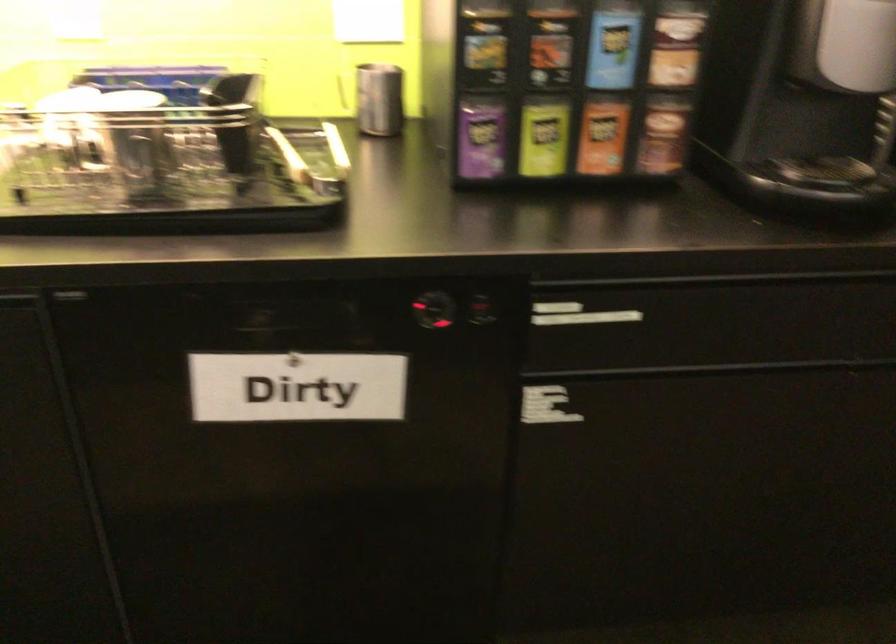
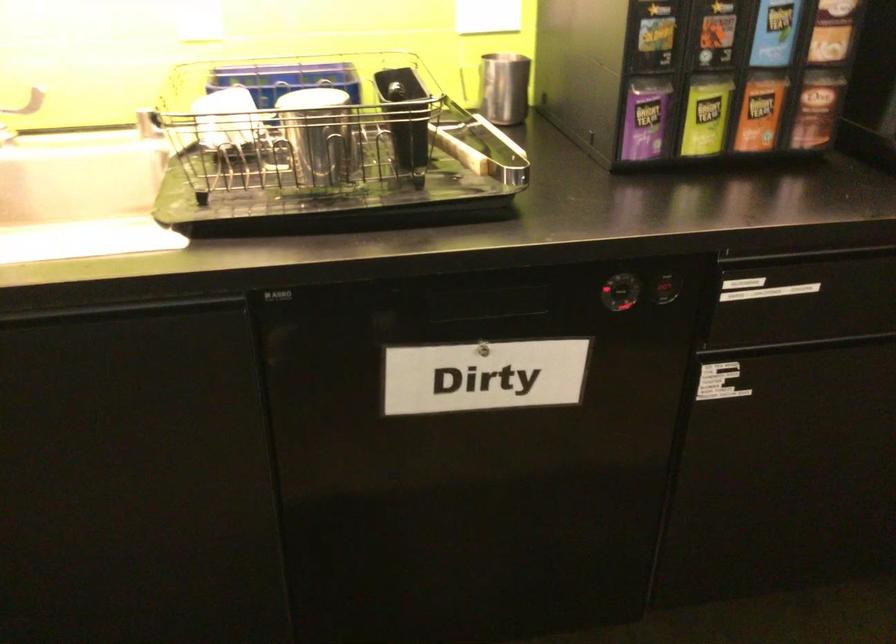
Find the pixel in the second image that matches point (625, 281) in the first image.

(807, 254)